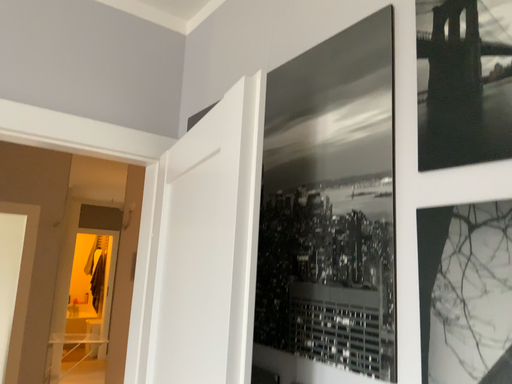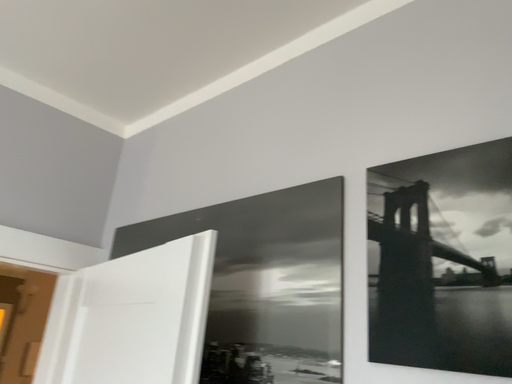
Question: Which way did the camera rotate in the video?

Choices:
 (A) rotated left
 (B) rotated right

Answer: (B)